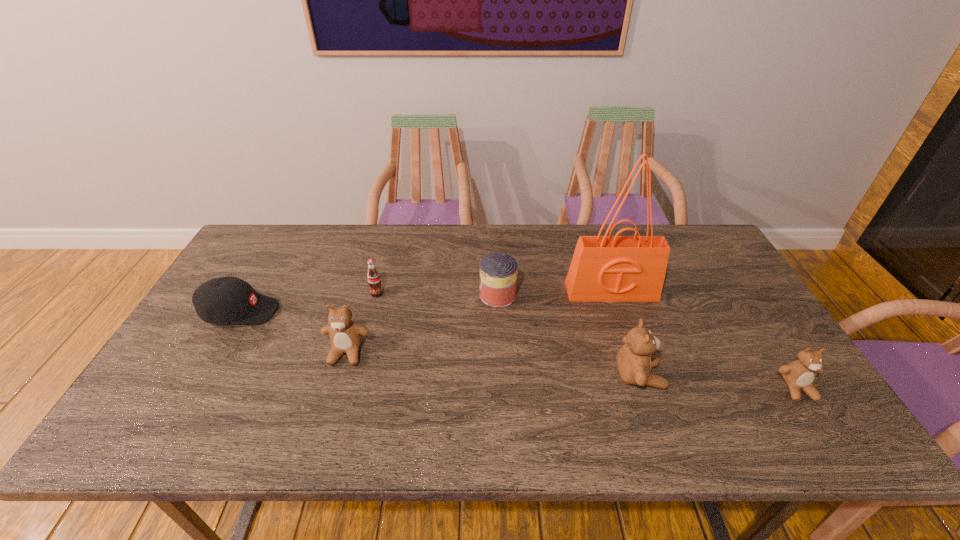
This screenshot has height=540, width=960. Identify the location of vacant space at the left edge of the desktop. (256, 271).

Identify the location of vacant area at the right edge. The image size is (960, 540). (761, 329).

At what (x,y) coordinates should I click in order to perform the action: click on vacant space at the far left corner of the desktop. Please return your answer as a coordinate pair (x, y). Looking at the image, I should click on (252, 262).

In the image, there is a desktop. Where is `free space at the far right corner`? This screenshot has height=540, width=960. free space at the far right corner is located at coordinates (690, 228).

Image resolution: width=960 pixels, height=540 pixels. What are the coordinates of `free space between the third tallest object and the tote bag` in the screenshot? It's located at (479, 322).

I want to click on vacant space in between the baseball cap and the can, so click(x=369, y=303).

This screenshot has height=540, width=960. I want to click on vacant space in between the soda and the fourth object from right to left, so click(x=438, y=294).

The height and width of the screenshot is (540, 960). Find the location of `vacant space that is in between the second teddy bear from left to right and the baseball cap`. vacant space that is in between the second teddy bear from left to right and the baseball cap is located at coordinates (440, 344).

This screenshot has height=540, width=960. In order to click on vacant space that is in between the shortest teddy bear and the soda in this screenshot , I will do `click(587, 341)`.

Where is `vacant area between the tote bag and the fifth shortest object`? The width and height of the screenshot is (960, 540). vacant area between the tote bag and the fifth shortest object is located at coordinates (479, 322).